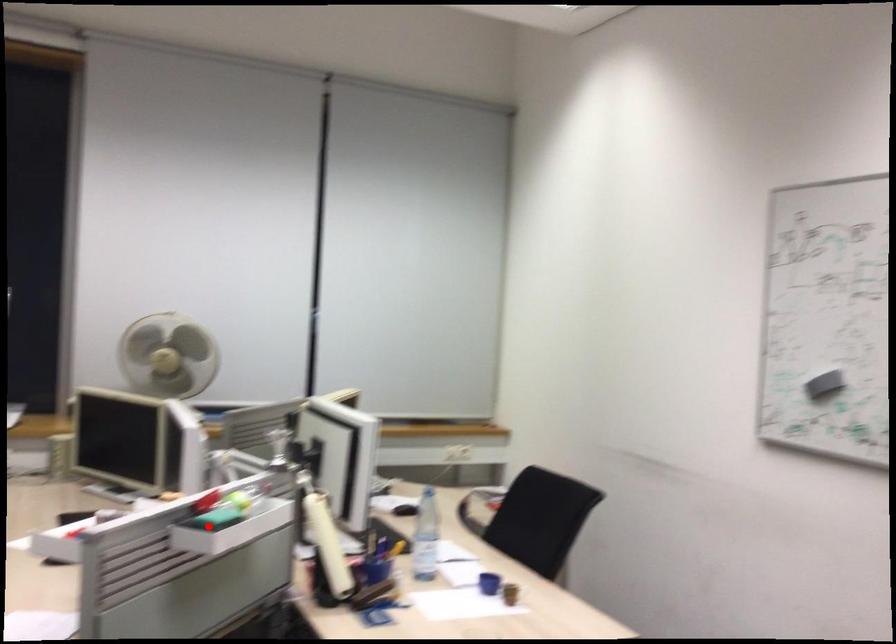
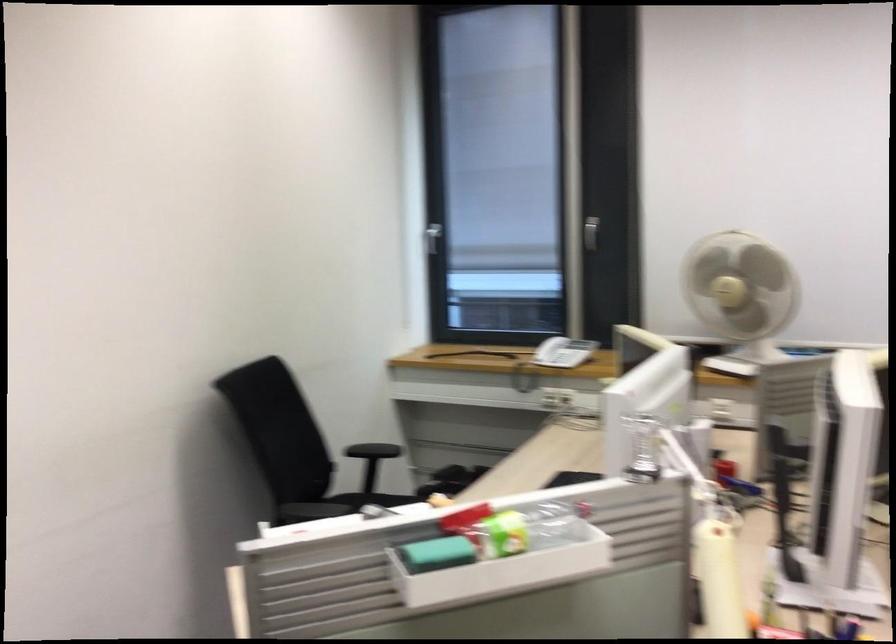
Where in the second image is the point corresponding to the highlighted location from the first image?

(436, 554)